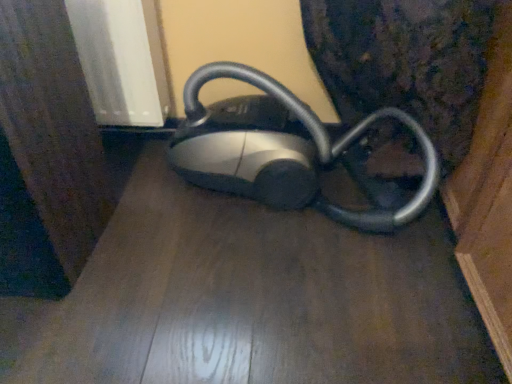
Find the location of a particular element. The width and height of the screenshot is (512, 384). free space above matte black vacuum cleaner at center (from a real-world perspective) is located at coordinates (259, 259).